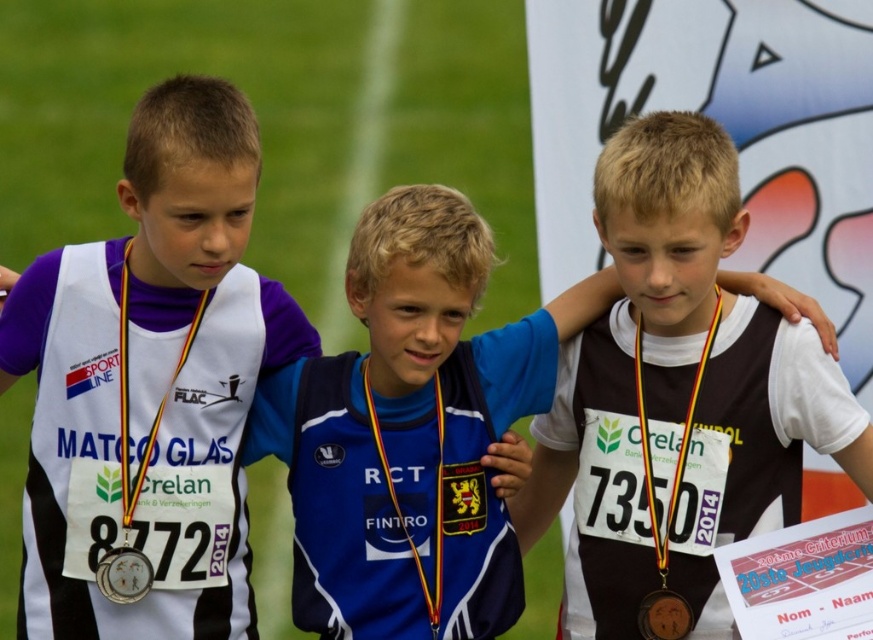
You are a photographer trying to capture a closeup of the brown fabric shirt at center and the silver metallic medal at center. Which object should you zoom in on to ensure both fit in the frame without cropping?

The brown fabric shirt at center is wider than the silver metallic medal at center, so you should zoom in on the brown fabric shirt at center to ensure both fit in the frame without cropping.

You are standing at the point marked by the coordinates point [396,211]. You want to walk to the point marked by the coordinates point 0.665, 0.545. How far will you have to walk?

You will have to walk 11.09 meters to reach the destination.

You are a photographer trying to capture a closeup shot of the medals. You notice the matte black vest at left and the white matte neck at center. Which object should you focus on to ensure the medal is in the frame without being blocked by the vest or neck?

The matte black vest at left is larger than the white matte neck at center, so focusing on the white matte neck at center would allow the medal to be visible without obstruction from the larger vest.